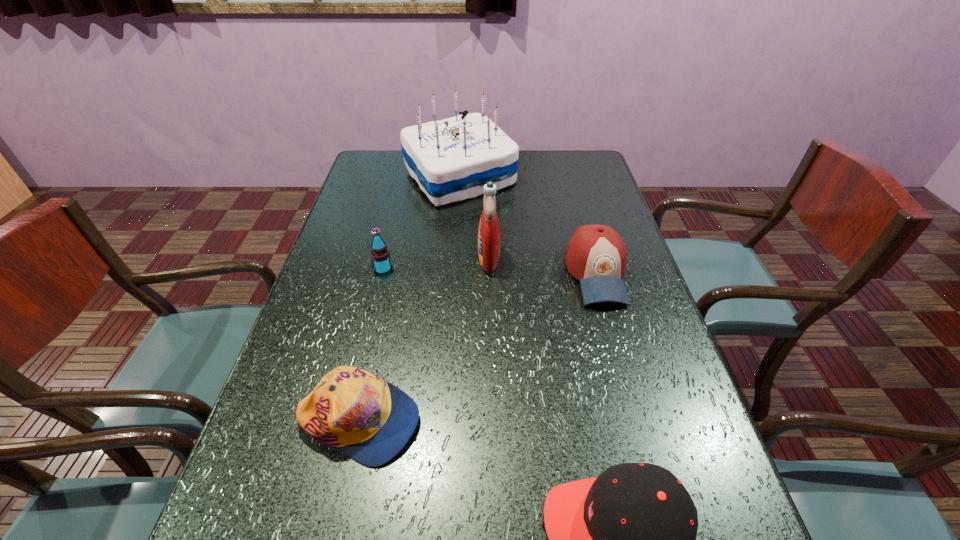
Where is `birthday cake`? The width and height of the screenshot is (960, 540). birthday cake is located at coordinates (452, 159).

Find the location of a particular element. the tallest object is located at coordinates (452, 159).

Where is `detergent`? The width and height of the screenshot is (960, 540). detergent is located at coordinates (489, 231).

Locate an element on the screen. The image size is (960, 540). soda is located at coordinates (380, 255).

At what (x,y) coordinates should I click in order to perform the action: click on baseball cap. Please return your answer as a coordinate pair (x, y). Looking at the image, I should click on (596, 255).

The height and width of the screenshot is (540, 960). In order to click on the left cap in this screenshot , I will do `click(370, 420)`.

This screenshot has width=960, height=540. I want to click on the fifth farthest object, so click(x=370, y=420).

Image resolution: width=960 pixels, height=540 pixels. I want to click on vacant space located 0.080m on the right of the farthest object, so click(540, 177).

Find the location of a particular element. The width and height of the screenshot is (960, 540). vacant area situated on the front surface of the fifth shortest object is located at coordinates (375, 258).

At what (x,y) coordinates should I click in order to perform the action: click on free spot located on the front surface of the fifth shortest object. Please return your answer as a coordinate pair (x, y). The image size is (960, 540). Looking at the image, I should click on (427, 258).